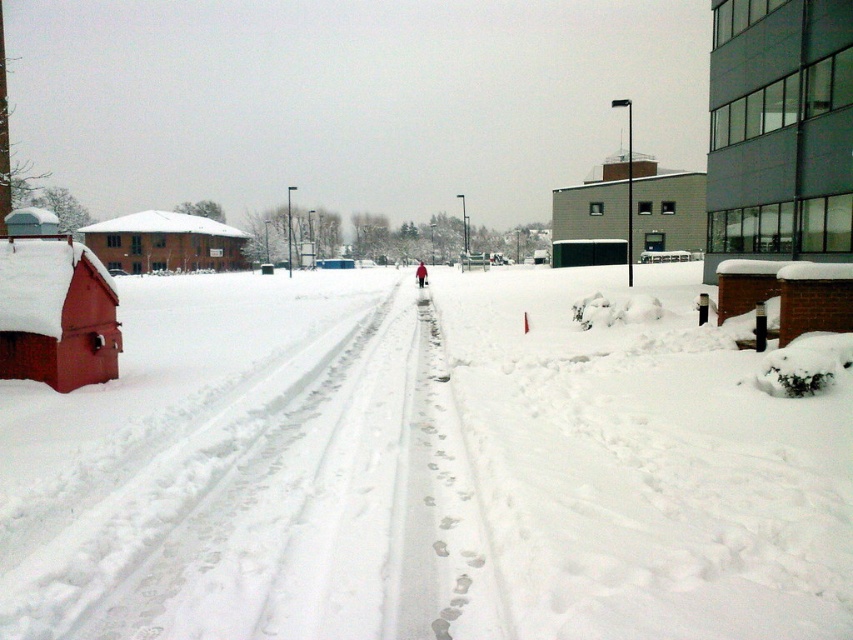
Who is more forward, (x=704, y=532) or (x=691, y=250)?

Point (x=704, y=532)

This screenshot has width=853, height=640. In order to click on white fluffy snow at lower left in this screenshot , I will do click(x=422, y=468).

The image size is (853, 640). Find the location of `white fluffy snow at lower left`. white fluffy snow at lower left is located at coordinates (422, 468).

Is gray concrete building at upper center to the left of brown wooden hut at left from the viewer's perspective?

No, gray concrete building at upper center is not to the left of brown wooden hut at left.

Is gray concrete building at upper center positioned at the back of brown wooden hut at left?

No, it is not.

Locate an element on the screen. gray concrete building at upper center is located at coordinates (668, 212).

This screenshot has width=853, height=640. Describe the element at coordinates (55, 312) in the screenshot. I see `smooth red wooden hut at left` at that location.

Can you confirm if smooth red wooden hut at left is taller than brown wooden hut at left?

No, smooth red wooden hut at left is not taller than brown wooden hut at left.

Is point (62, 323) positioned behind point (196, 259)?

No, (62, 323) is closer to viewer.

At what (x,y) coordinates should I click in order to perform the action: click on smooth red wooden hut at left. Please return your answer as a coordinate pair (x, y). The image size is (853, 640). Looking at the image, I should click on (55, 312).